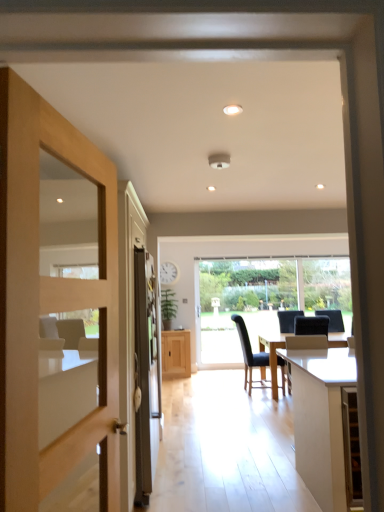
Question: Can you confirm if metallic silver screen door at left is positioned to the left of light wood door at left?

Choices:
 (A) no
 (B) yes

Answer: (B)

Question: Considering the relative positions of metallic silver screen door at left and light wood door at left in the image provided, is metallic silver screen door at left to the right of light wood door at left from the viewer's perspective?

Choices:
 (A) no
 (B) yes

Answer: (A)

Question: Is metallic silver screen door at left positioned in front of light wood door at left?

Choices:
 (A) yes
 (B) no

Answer: (B)

Question: From a real-world perspective, is metallic silver screen door at left positioned under light wood door at left based on gravity?

Choices:
 (A) yes
 (B) no

Answer: (A)

Question: From the image's perspective, does metallic silver screen door at left appear higher than light wood door at left?

Choices:
 (A) no
 (B) yes

Answer: (A)

Question: Does metallic silver screen door at left have a larger size compared to light wood door at left?

Choices:
 (A) no
 (B) yes

Answer: (B)

Question: From a real-world perspective, is metallic silver screen door at left below white glossy table at lower right?

Choices:
 (A) yes
 (B) no

Answer: (B)

Question: Is metallic silver screen door at left at the left side of white glossy table at lower right?

Choices:
 (A) no
 (B) yes

Answer: (B)

Question: Considering the relative positions of metallic silver screen door at left and white glossy table at lower right in the image provided, is metallic silver screen door at left to the right of white glossy table at lower right from the viewer's perspective?

Choices:
 (A) no
 (B) yes

Answer: (A)

Question: Does metallic silver screen door at left have a greater height compared to white glossy table at lower right?

Choices:
 (A) yes
 (B) no

Answer: (A)

Question: Can you confirm if metallic silver screen door at left is shorter than white glossy table at lower right?

Choices:
 (A) yes
 (B) no

Answer: (B)

Question: Could you tell me if metallic silver screen door at left is turned towards white glossy table at lower right?

Choices:
 (A) no
 (B) yes

Answer: (B)

Question: Is white glossy table at lower right at the back of black leather chair at center, which is the second chair from left to right?

Choices:
 (A) no
 (B) yes

Answer: (B)